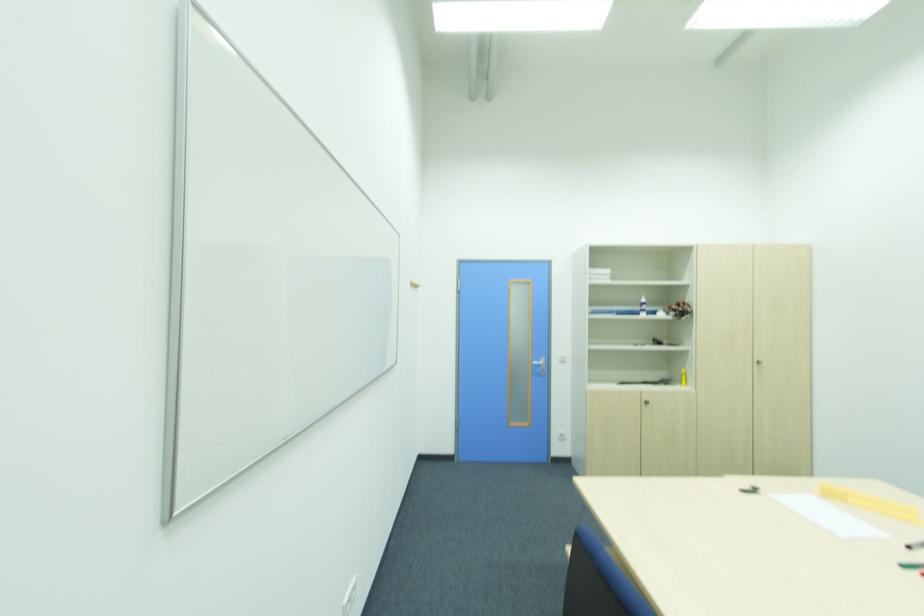
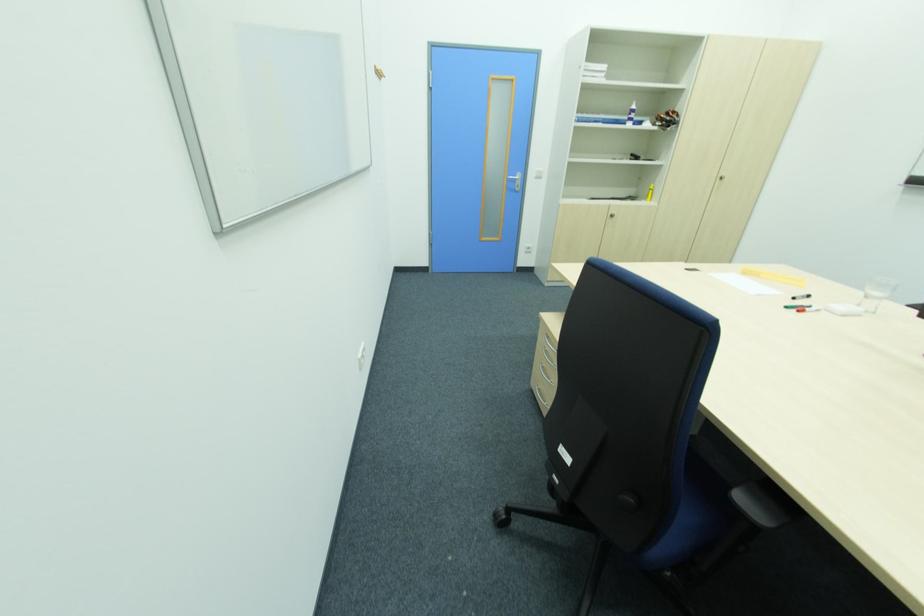
Question: The images are taken continuously from a first-person perspective. In which direction is your viewpoint rotating?

Choices:
 (A) Left
 (B) Right
 (C) Up
 (D) Down

Answer: (D)